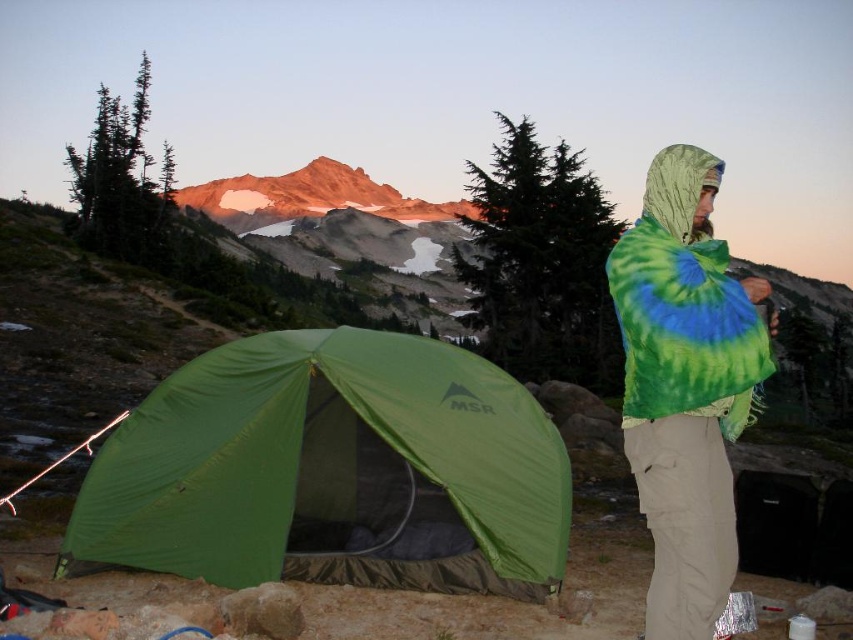
Question: Is tie-dye fabric at right behind green matte pine at center?

Choices:
 (A) no
 (B) yes

Answer: (A)

Question: Which point is closer to the camera?

Choices:
 (A) green fabric tent at lower left
 (B) rustic granite peak at upper center
 (C) green matte pine at center
 (D) tie-dye fabric at right

Answer: (D)

Question: Which object is the farthest from the tie-dye fabric at right?

Choices:
 (A) green fabric tent at lower left
 (B) rustic granite peak at upper center
 (C) green matte pine at center

Answer: (B)

Question: Where is tie-dye fabric at right located in relation to green matte pine at center in the image?

Choices:
 (A) left
 (B) right

Answer: (B)

Question: Which of the following is the closest to the observer?

Choices:
 (A) (448, 204)
 (B) (412, 380)
 (C) (479, 324)
 (D) (737, 340)

Answer: (D)

Question: Observing the image, what is the correct spatial positioning of tie-dye fabric at right in reference to green matte pine at center?

Choices:
 (A) below
 (B) above

Answer: (A)